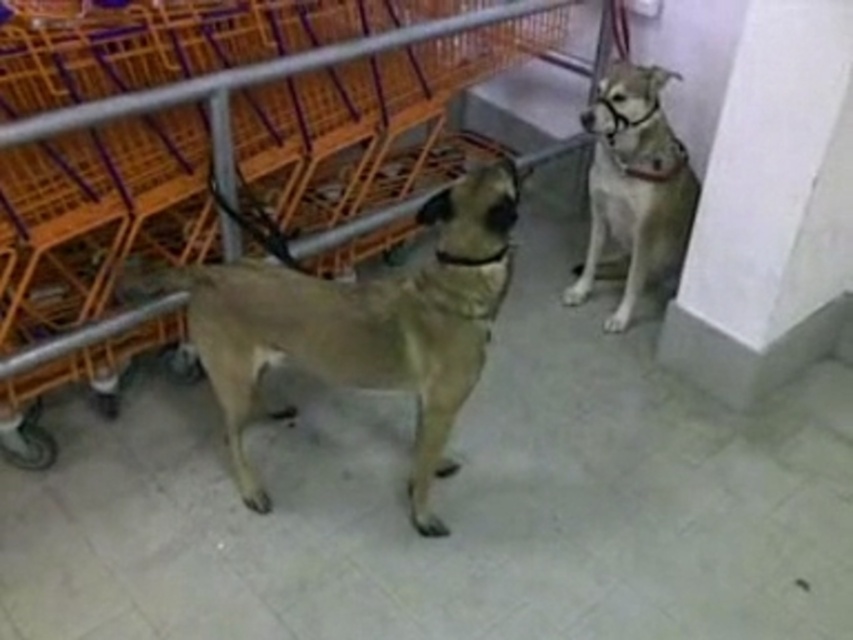
Question: Does light brown fur at center appear on the left side of light brown fur at upper right?

Choices:
 (A) yes
 (B) no

Answer: (A)

Question: Considering the real-world distances, which object is farthest from the light brown fur at upper right?

Choices:
 (A) light brown fur at center
 (B) orange plastic cart at left

Answer: (A)

Question: Is light brown fur at center thinner than light brown fur at upper right?

Choices:
 (A) no
 (B) yes

Answer: (A)

Question: Estimate the real-world distances between objects in this image. Which object is closer to the orange plastic cart at left?

Choices:
 (A) light brown fur at center
 (B) light brown fur at upper right

Answer: (A)

Question: Is orange plastic cart at left smaller than light brown fur at upper right?

Choices:
 (A) no
 (B) yes

Answer: (A)

Question: Considering the real-world distances, which object is closest to the light brown fur at center?

Choices:
 (A) light brown fur at upper right
 (B) orange plastic cart at left

Answer: (B)